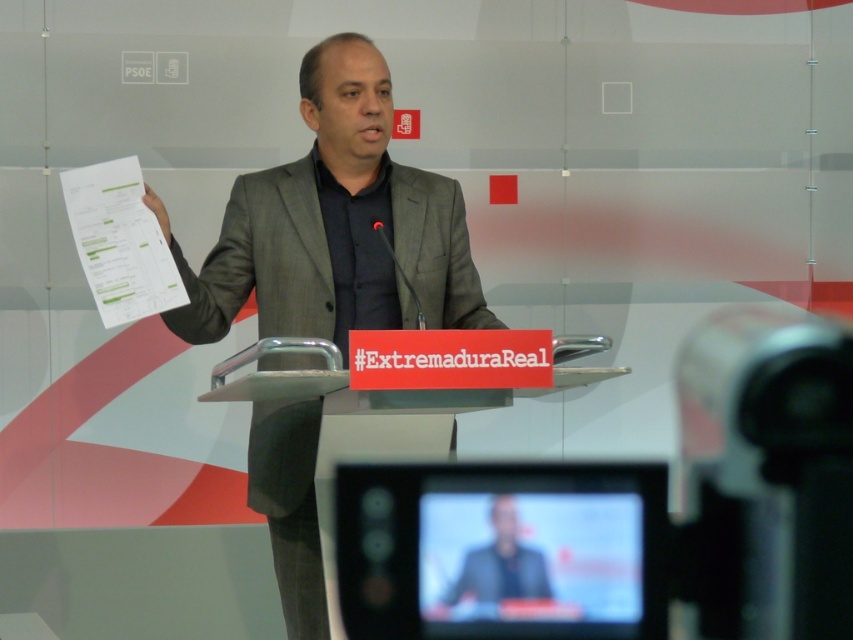
Between gray suit at center and dark gray suit at center, which one is positioned higher?

Result: gray suit at center is higher up.

Locate an element on the screen. The height and width of the screenshot is (640, 853). gray suit at center is located at coordinates (334, 225).

Is point (427, 209) positioned in front of point (540, 589)?

Yes, point (427, 209) is in front of point (540, 589).

You are a GUI agent. You are given a task and a screenshot of the screen. Output one action in this format:
    pyautogui.click(x=<x>, y=<y>)
    Task: Click on the gray suit at center
    
    Given the screenshot: What is the action you would take?
    pyautogui.click(x=334, y=225)